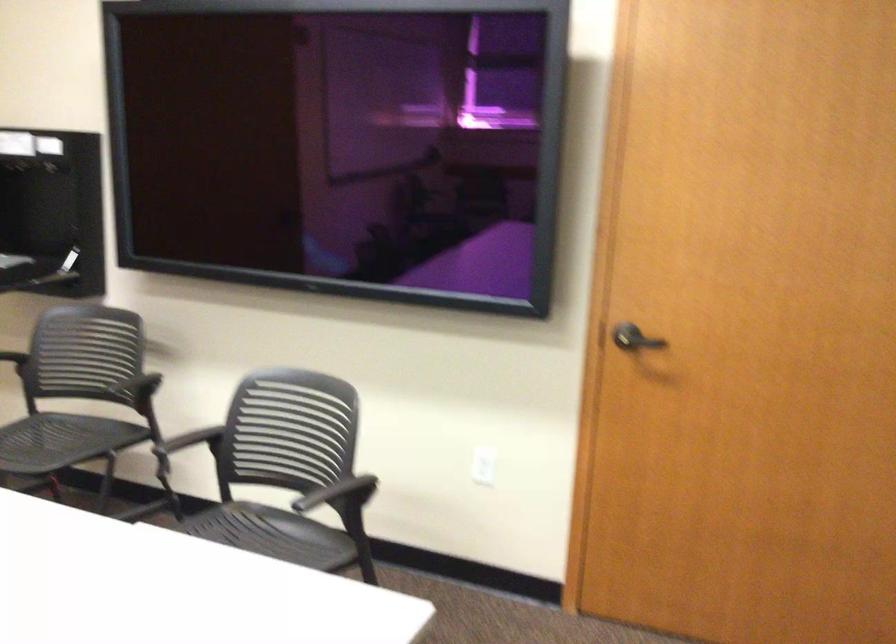
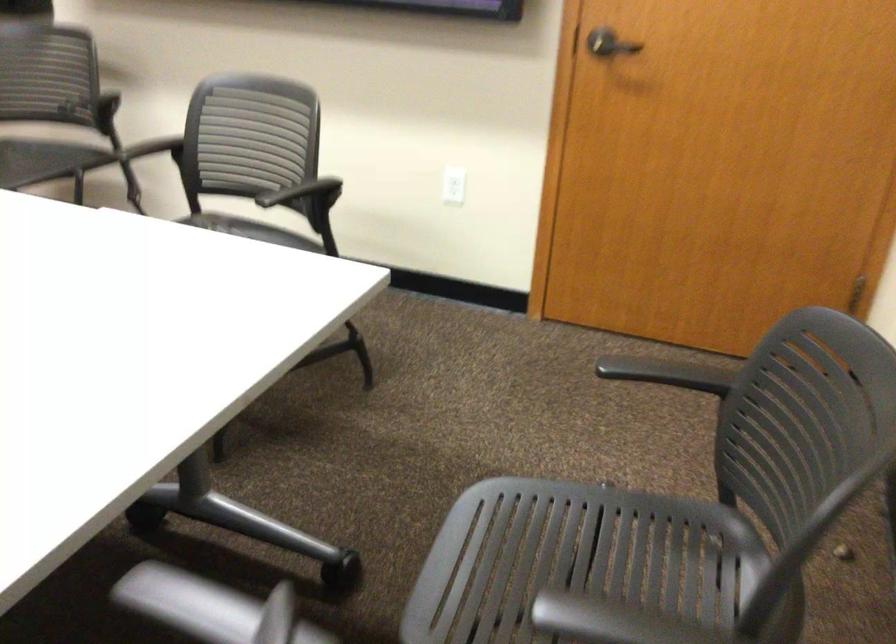
Question: Based on the continuous images, in which direction is the camera rotating? Reply with the corresponding letter.

Choices:
 (A) Left
 (B) Right
 (C) Up
 (D) Down

Answer: (D)